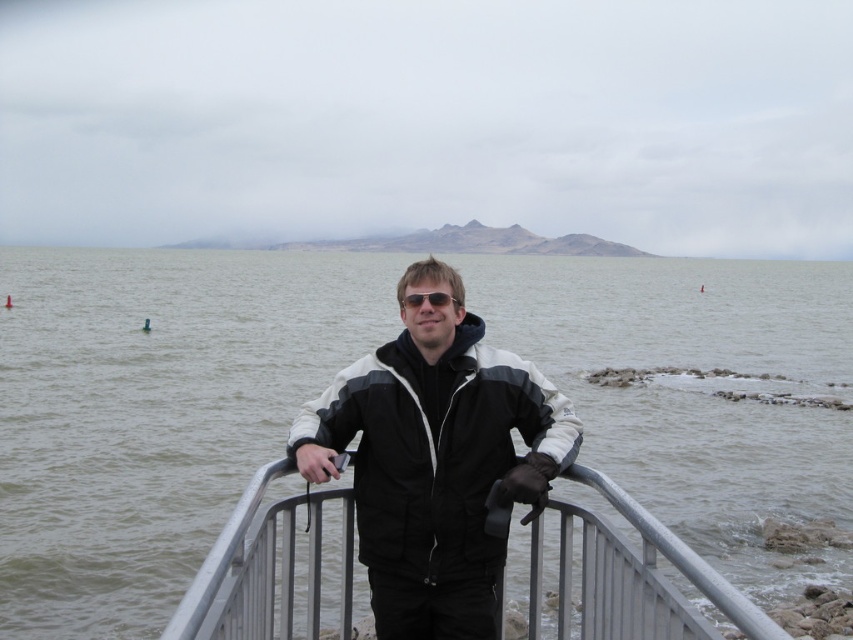
You are a drone operator trying to locate a specific point in the image. The point is marked as point [154,412]. Based on the scene description, where would this point be located in relation to the gray water at center?

The point [154,412] is located on the gray water at center according to the description.

You are a photographer trying to capture the scene with the black matte jacket at center and the silver metallic fence at center. Based on their positions, which object should you frame first to ensure both are in the shot?

The silver metallic fence at center should be framed first because the black matte jacket at center is to the right of it, so positioning the fence first ensures there is space to include both objects in the frame.